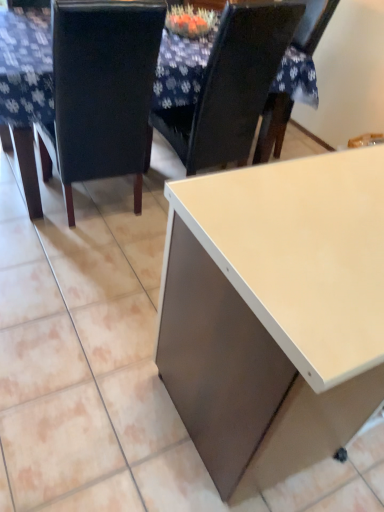
The height and width of the screenshot is (512, 384). Describe the element at coordinates (235, 83) in the screenshot. I see `matte black chair at upper center, acting as the 1th chair starting from the right` at that location.

This screenshot has width=384, height=512. What do you see at coordinates (101, 91) in the screenshot?
I see `black leather chair at left, which appears as the second chair when viewed from the right` at bounding box center [101, 91].

This screenshot has width=384, height=512. I want to click on matte white desk at lower right, so point(269,294).

In order to face matte white desk at lower right, should I rotate leftwards or rightwards?

It's best to rotate right around 22.671 degrees.

The image size is (384, 512). Describe the element at coordinates (25, 68) in the screenshot. I see `white glossy table at center` at that location.

What are the coordinates of `matte black chair at upper center, acting as the 1th chair starting from the right` in the screenshot? It's located at 235,83.

From the image's perspective, is matte white desk at lower right above or below matte black chair at upper center, positioned as the second chair in left-to-right order?

matte white desk at lower right is situated lower than matte black chair at upper center, positioned as the second chair in left-to-right order, in the image.

How different are the orientations of matte white desk at lower right and matte black chair at upper center, acting as the 1th chair starting from the right, in degrees?

The facing directions of matte white desk at lower right and matte black chair at upper center, acting as the 1th chair starting from the right, are 85.4 degrees apart.

Where is `the 1st chair to the left when counting from the matte white desk at lower right`? the 1st chair to the left when counting from the matte white desk at lower right is located at coordinates (235, 83).

Which of these two, matte white desk at lower right or black leather chair at left, which appears as the second chair when viewed from the right, stands shorter?

With less height is matte white desk at lower right.

Is point (338, 374) positioned behind point (72, 140)?

No, (338, 374) is in front of (72, 140).

Locate an element on the screen. desk in front of the black leather chair at left, which appears as the second chair when viewed from the right is located at coordinates (269, 294).

From the picture: Considering the positions of objects matte black chair at upper center, acting as the 1th chair starting from the right, and white glossy table at center in the image provided, who is more to the left, matte black chair at upper center, acting as the 1th chair starting from the right, or white glossy table at center?

From the viewer's perspective, white glossy table at center appears more on the left side.

Is matte black chair at upper center, positioned as the second chair in left-to-right order, looking in the opposite direction of white glossy table at center?

Yes, matte black chair at upper center, positioned as the second chair in left-to-right order,'s orientation is away from white glossy table at center.

What's the angular difference between matte black chair at upper center, positioned as the second chair in left-to-right order, and white glossy table at center's facing directions?

There is a 83.9-degree angle between the facing directions of matte black chair at upper center, positioned as the second chair in left-to-right order, and white glossy table at center.

The width and height of the screenshot is (384, 512). In order to click on chair on the right of white glossy table at center in this screenshot , I will do (x=235, y=83).

Is matte white desk at lower right behind white glossy table at center?

No.

In terms of height, does matte white desk at lower right look taller or shorter compared to white glossy table at center?

matte white desk at lower right is taller than white glossy table at center.

Consider the image. Which of these two, matte white desk at lower right or white glossy table at center, is wider?

With larger width is white glossy table at center.

Is black leather chair at left, the 1th chair in the left-to-right sequence, at the left side of matte black chair at upper center, acting as the 1th chair starting from the right?

Indeed, black leather chair at left, the 1th chair in the left-to-right sequence, is positioned on the left side of matte black chair at upper center, acting as the 1th chair starting from the right.

Consider the image. Could you tell me if black leather chair at left, the 1th chair in the left-to-right sequence, is turned towards matte black chair at upper center, acting as the 1th chair starting from the right?

No.

Could you measure the distance between black leather chair at left, the 1th chair in the left-to-right sequence, and matte black chair at upper center, positioned as the second chair in left-to-right order?

A distance of 40.51 centimeters exists between black leather chair at left, the 1th chair in the left-to-right sequence, and matte black chair at upper center, positioned as the second chair in left-to-right order.

Relative to matte black chair at upper center, positioned as the second chair in left-to-right order, is black leather chair at left, the 1th chair in the left-to-right sequence, in front or behind?

Visually, black leather chair at left, the 1th chair in the left-to-right sequence, is located in front of matte black chair at upper center, positioned as the second chair in left-to-right order.

Is matte black chair at upper center, acting as the 1th chair starting from the right, inside the boundaries of matte white desk at lower right, or outside?

matte black chair at upper center, acting as the 1th chair starting from the right, is not enclosed by matte white desk at lower right.

In the scene shown: Can you confirm if matte black chair at upper center, positioned as the second chair in left-to-right order, is thinner than matte white desk at lower right?

Yes, matte black chair at upper center, positioned as the second chair in left-to-right order, is thinner than matte white desk at lower right.

In the scene shown: From a real-world perspective, which is physically above, matte black chair at upper center, acting as the 1th chair starting from the right, or matte white desk at lower right?

matte black chair at upper center, acting as the 1th chair starting from the right, is physically above.

Considering their positions, is matte black chair at upper center, acting as the 1th chair starting from the right, located in front of or behind black leather chair at left, which appears as the second chair when viewed from the right?

In the image, matte black chair at upper center, acting as the 1th chair starting from the right, appears behind black leather chair at left, which appears as the second chair when viewed from the right.

Would you say matte black chair at upper center, positioned as the second chair in left-to-right order, is outside black leather chair at left, the 1th chair in the left-to-right sequence?

Absolutely, matte black chair at upper center, positioned as the second chair in left-to-right order, is external to black leather chair at left, the 1th chair in the left-to-right sequence.

Which of these two, matte black chair at upper center, positioned as the second chair in left-to-right order, or black leather chair at left, the 1th chair in the left-to-right sequence, stands taller?

Standing taller between the two is matte black chair at upper center, positioned as the second chair in left-to-right order.

You are a GUI agent. You are given a task and a screenshot of the screen. Output one action in this format:
    pyautogui.click(x=<x>, y=<y>)
    Task: Click on the 2nd chair behind the matte white desk at lower right
    This screenshot has height=512, width=384.
    Given the screenshot: What is the action you would take?
    pyautogui.click(x=235, y=83)

What are the coordinates of `desk that is in front of the black leather chair at left, the 1th chair in the left-to-right sequence` in the screenshot? It's located at pyautogui.click(x=269, y=294).

Considering their positions, is matte black chair at upper center, positioned as the second chair in left-to-right order, positioned further to black leather chair at left, which appears as the second chair when viewed from the right, than white glossy table at center?

matte black chair at upper center, positioned as the second chair in left-to-right order, lies further to black leather chair at left, which appears as the second chair when viewed from the right, than the other object.

From the image, which object appears to be farther from matte white desk at lower right, matte black chair at upper center, positioned as the second chair in left-to-right order, or white glossy table at center?

Among the two, white glossy table at center is located further to matte white desk at lower right.

From the image, which object appears to be farther from white glossy table at center, matte white desk at lower right or matte black chair at upper center, positioned as the second chair in left-to-right order?

The object further to white glossy table at center is matte white desk at lower right.

From the image, which object appears to be farther from black leather chair at left, which appears as the second chair when viewed from the right, matte black chair at upper center, acting as the 1th chair starting from the right, or matte white desk at lower right?

The object further to black leather chair at left, which appears as the second chair when viewed from the right, is matte white desk at lower right.

Based on their spatial positions, is matte black chair at upper center, positioned as the second chair in left-to-right order, or black leather chair at left, the 1th chair in the left-to-right sequence, closer to matte white desk at lower right?

black leather chair at left, the 1th chair in the left-to-right sequence.

Estimate the real-world distances between objects in this image. Which object is closer to white glossy table at center, black leather chair at left, the 1th chair in the left-to-right sequence, or matte black chair at upper center, acting as the 1th chair starting from the right?

black leather chair at left, the 1th chair in the left-to-right sequence, lies closer to white glossy table at center than the other object.

From the image, which object appears to be farther from matte black chair at upper center, acting as the 1th chair starting from the right, matte white desk at lower right or black leather chair at left, the 1th chair in the left-to-right sequence?

matte white desk at lower right lies further to matte black chair at upper center, acting as the 1th chair starting from the right, than the other object.

From the image, which object appears to be nearer to black leather chair at left, the 1th chair in the left-to-right sequence, matte white desk at lower right or white glossy table at center?

white glossy table at center lies closer to black leather chair at left, the 1th chair in the left-to-right sequence, than the other object.

The image size is (384, 512). Find the location of `table between black leather chair at left, which appears as the second chair when viewed from the right, and matte white desk at lower right from left to right`. table between black leather chair at left, which appears as the second chair when viewed from the right, and matte white desk at lower right from left to right is located at coordinates (25, 68).

At what (x,y) coordinates should I click in order to perform the action: click on table between black leather chair at left, the 1th chair in the left-to-right sequence, and matte black chair at upper center, positioned as the second chair in left-to-right order, from left to right. Please return your answer as a coordinate pair (x, y). The height and width of the screenshot is (512, 384). Looking at the image, I should click on (25, 68).

Identify the location of chair that lies between matte black chair at upper center, acting as the 1th chair starting from the right, and matte white desk at lower right from top to bottom. The height and width of the screenshot is (512, 384). (101, 91).